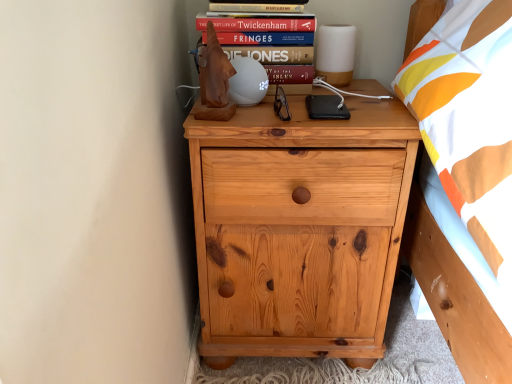
Question: From a real-world perspective, is hardcover book at upper center above or below natural wood chest of drawers at center?

Choices:
 (A) below
 (B) above

Answer: (B)

Question: Which is correct: hardcover book at upper center is inside natural wood chest of drawers at center, or outside of it?

Choices:
 (A) outside
 (B) inside

Answer: (A)

Question: Estimate the real-world distances between objects in this image. Which object is farther from the natural wood chest of drawers at center?

Choices:
 (A) hardcover book at upper center
 (B) hardcover book at upper center

Answer: (B)

Question: Estimate the real-world distances between objects in this image. Which object is farther from the hardcover book at upper center?

Choices:
 (A) natural wood chest of drawers at center
 (B) hardcover book at upper center

Answer: (A)